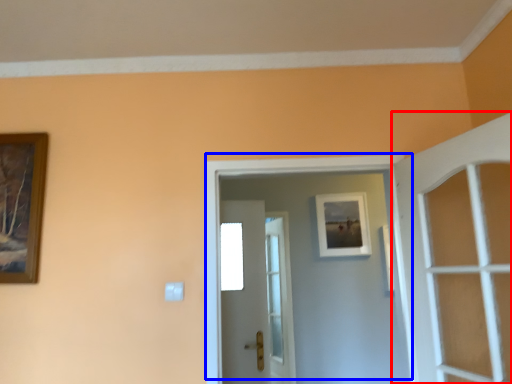
Question: Among these objects, which one is farthest to the camera, door (highlighted by a red box) or door (highlighted by a blue box)?

Choices:
 (A) door
 (B) door

Answer: (B)